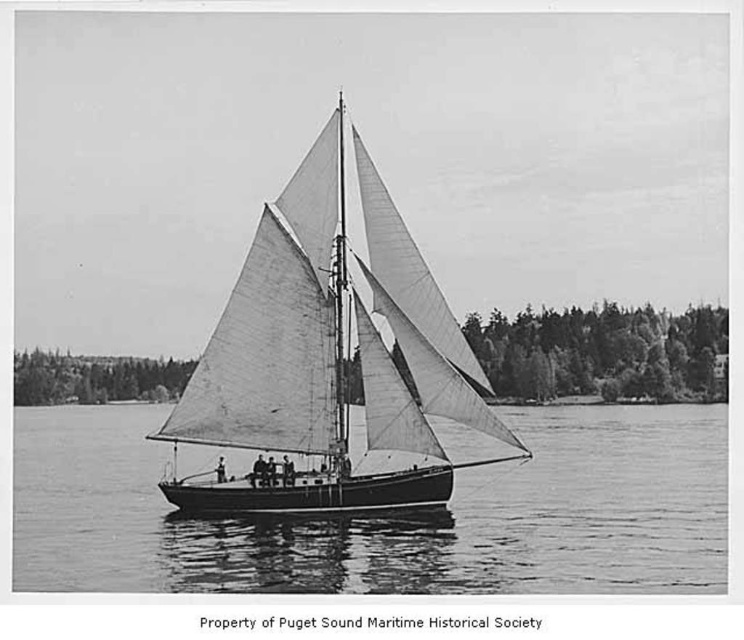
You are a photographer trying to capture a shot of the white canvas sail at center and the smooth water at center. According to the scene, which object is positioned to the right of the other?

The smooth water at center is to the right of the white canvas sail at center, so the smooth water at center is positioned to the right of the white canvas sail at center.

Based on the scene, where is the smooth water at center located in terms of coordinates?

The smooth water at center is located at coordinates point (388, 515).